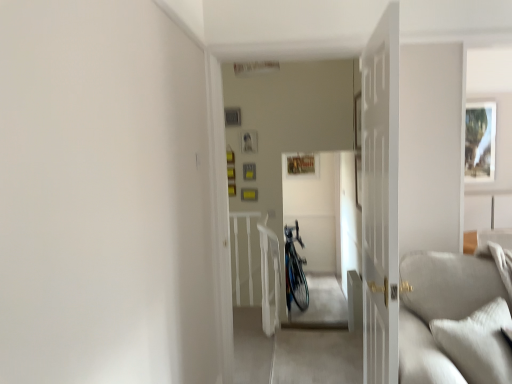
Question: Is point (304, 278) positioned closer to the camera than point (465, 170)?

Choices:
 (A) closer
 (B) farther

Answer: (A)

Question: Is shiny metallic bicycle at center taller or shorter than matte white picture frame at upper right?

Choices:
 (A) short
 (B) tall

Answer: (B)

Question: Considering the real-world distances, which object is farthest from the matte white picture frame at upper right?

Choices:
 (A) light gray corduroy couch at lower right
 (B) white wooden door at center
 (C) shiny metallic bicycle at center

Answer: (B)

Question: Based on their relative distances, which object is farther from the light gray corduroy couch at lower right?

Choices:
 (A) matte white picture frame at upper right
 (B) white wooden door at center
 (C) shiny metallic bicycle at center

Answer: (A)